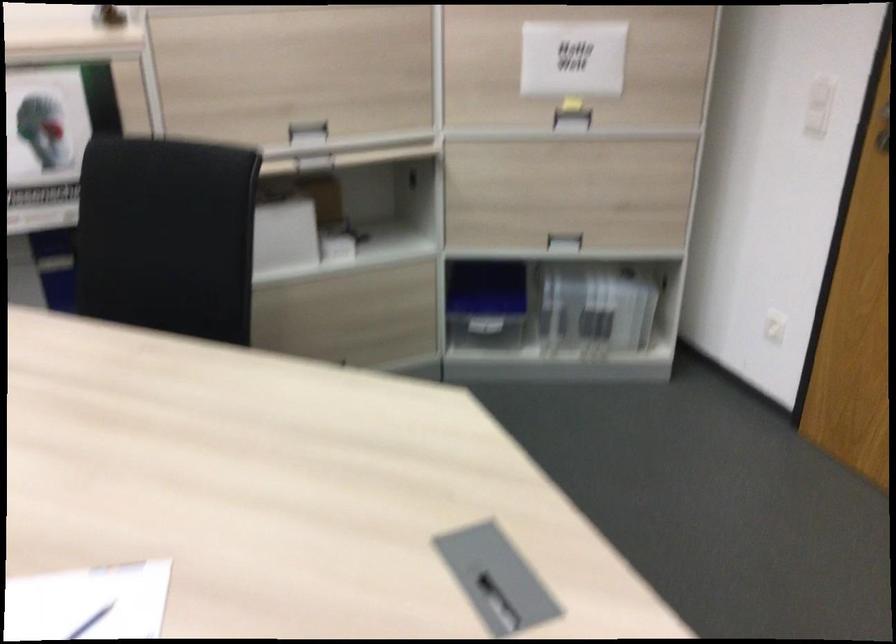
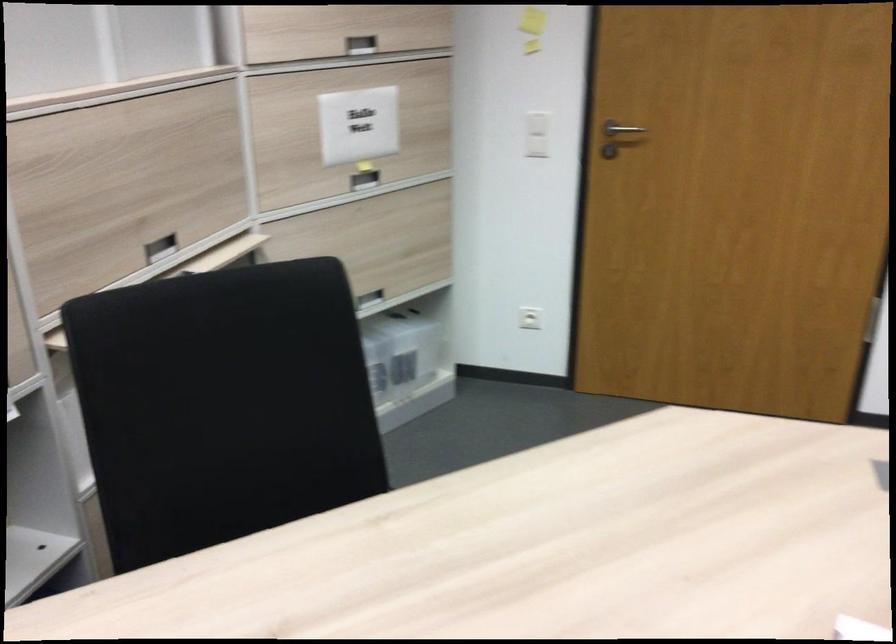
Question: I am providing you with two images of the same scene from different viewpoints. Please identify which objects are invisible in image2.

Choices:
 (A) metal door handle
 (B) recessed cabinet handle
 (C) blue plastic container
 (D) red and white toothbrush

Answer: (C)